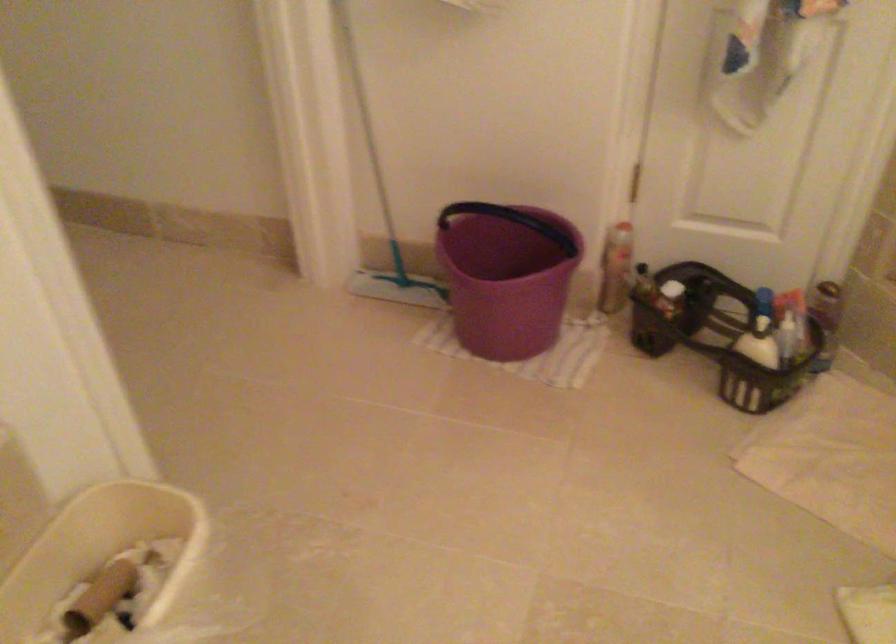
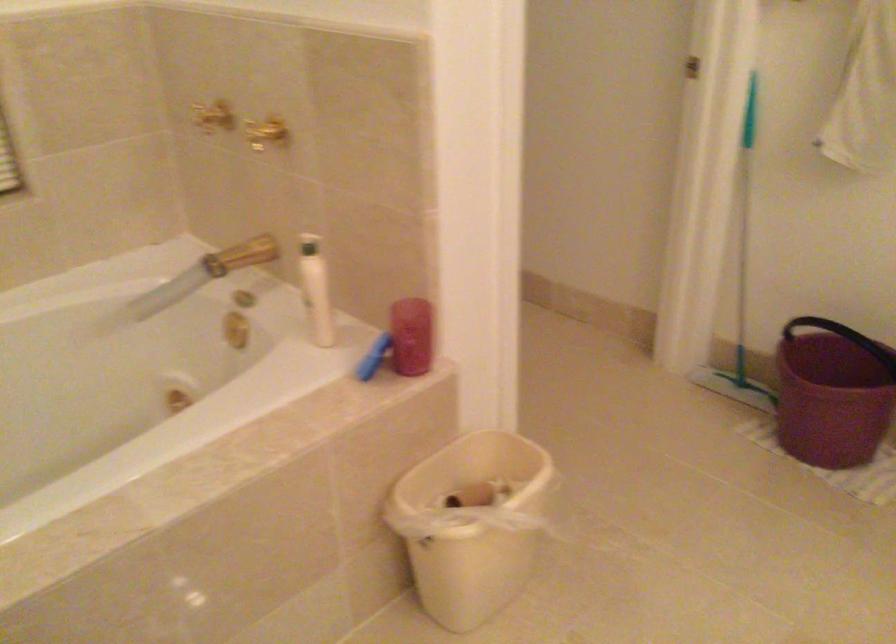
The point at (510, 290) is marked in the first image. Where is the corresponding point in the second image?

(831, 393)